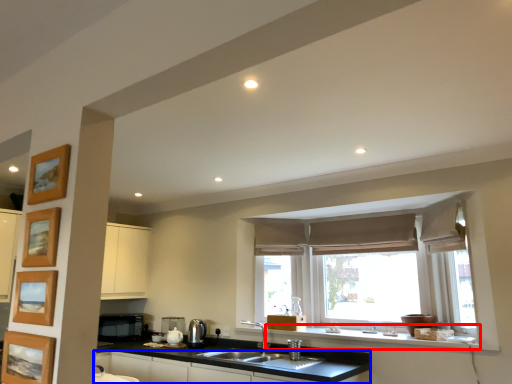
Question: Which object is further to the camera taking this photo, window sill (highlighted by a red box) or cabinetry (highlighted by a blue box)?

Choices:
 (A) window sill
 (B) cabinetry

Answer: (A)